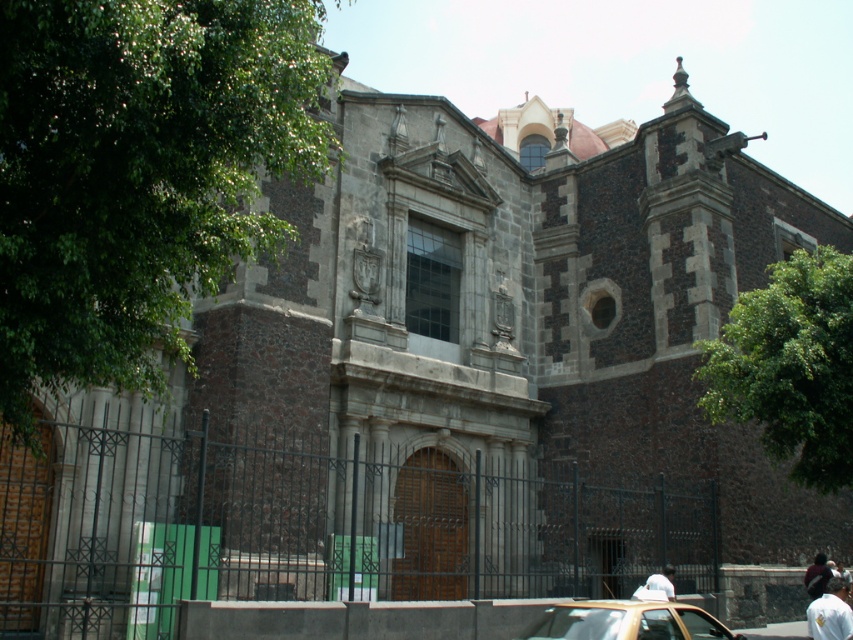
You are a fashion designer observing the historic stone building scene. You notice the white fabric shirt at lower right and the dark brown leather jacket at center. Which clothing item is positioned higher up in the image?

The white fabric shirt at lower right is located above the dark brown leather jacket at center, meaning it is positioned higher up in the image.

You are a photographer standing in front of the historic stone building. You see a gold metallic car at lower center and a dark brown leather jacket at center. Which object is taller?

The gold metallic car at lower center is much taller than the dark brown leather jacket at center.

You are standing at point (711, 616) and want to reach the central arched doorway. The path is 165.07 feet long. If you walk at a speed of 3 feet per second, how many seconds will it take you to reach the doorway?

The path between point (711, 616) and the central arched doorway is 165.07 feet long. At a walking speed of 3 feet per second, it will take 165.07 divided by 3, which is approximately 55.02 seconds to reach the doorway.